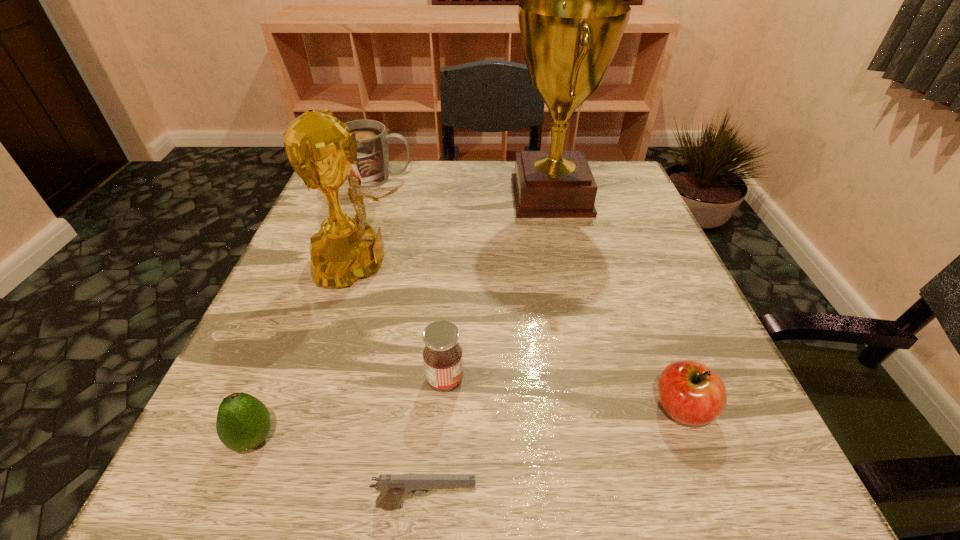
Where is `avocado that is at the near edge`? The image size is (960, 540). avocado that is at the near edge is located at coordinates [243, 422].

Image resolution: width=960 pixels, height=540 pixels. Identify the location of pistol present at the near edge. (394, 488).

Identify the location of award present at the left edge. (319, 147).

Where is `mug that is at the left edge`? The image size is (960, 540). mug that is at the left edge is located at coordinates (372, 169).

You are a GUI agent. You are given a task and a screenshot of the screen. Output one action in this format:
    pyautogui.click(x=<x>, y=<y>)
    Task: Click on the avocado that is at the left edge
    The image size is (960, 540).
    Given the screenshot: What is the action you would take?
    pyautogui.click(x=243, y=422)

Locate an element on the screen. This screenshot has height=540, width=960. award that is at the right edge is located at coordinates (571, 23).

Locate an element on the screen. Image resolution: width=960 pixels, height=540 pixels. apple at the right edge is located at coordinates (691, 393).

Locate an element on the screen. The image size is (960, 540). object present at the far left corner is located at coordinates (372, 169).

Find the location of a particular element. Image resolution: width=960 pixels, height=540 pixels. object situated at the near left corner is located at coordinates (243, 422).

At what (x,y) coordinates should I click in order to perform the action: click on object positioned at the far right corner. Please return your answer as a coordinate pair (x, y). This screenshot has height=540, width=960. Looking at the image, I should click on (571, 23).